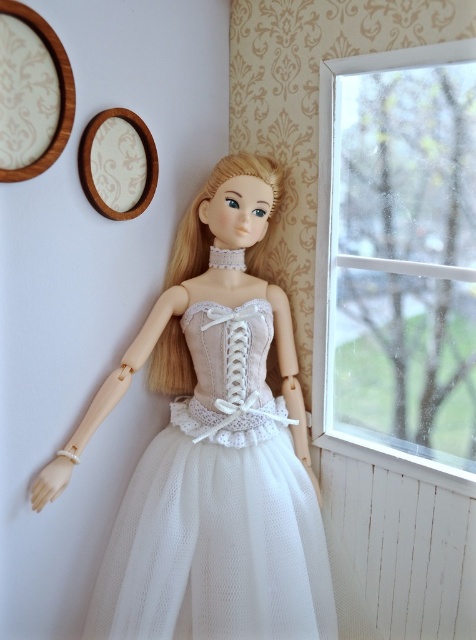
Does white tulle dress at center appear on the left side of white wood at lower right?

Correct, you'll find white tulle dress at center to the left of white wood at lower right.

Does white tulle dress at center have a lesser width compared to white wood at lower right?

No, white tulle dress at center is not thinner than white wood at lower right.

Is point (188, 456) closer to camera compared to point (390, 458)?

That is True.

Identify the location of white tulle dress at center. The width and height of the screenshot is (476, 640). (218, 508).

Based on the photo, which of these two, transparent glass window at right or white wood at lower right, stands taller?

transparent glass window at right

Identify the location of transparent glass window at right. This screenshot has height=640, width=476. (397, 262).

Find the location of a particular element. The width and height of the screenshot is (476, 640). transparent glass window at right is located at coordinates (397, 262).

What are the coordinates of `transparent glass window at right` in the screenshot? It's located at (397, 262).